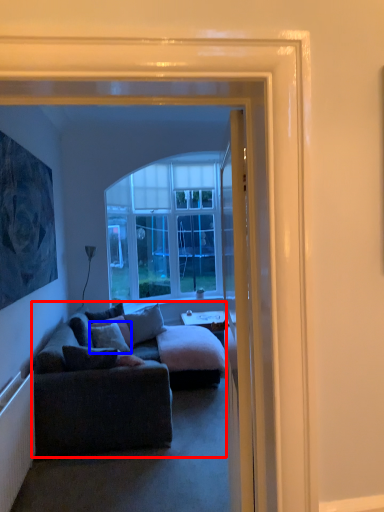
Question: Among these objects, which one is nearest to the camera, studio couch (highlighted by a red box) or pillow (highlighted by a blue box)?

Choices:
 (A) studio couch
 (B) pillow

Answer: (A)